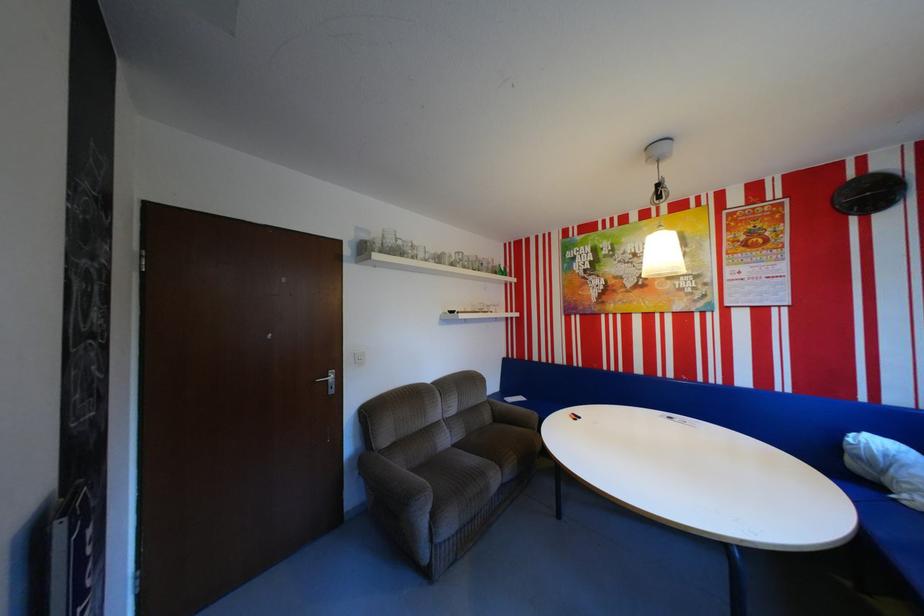
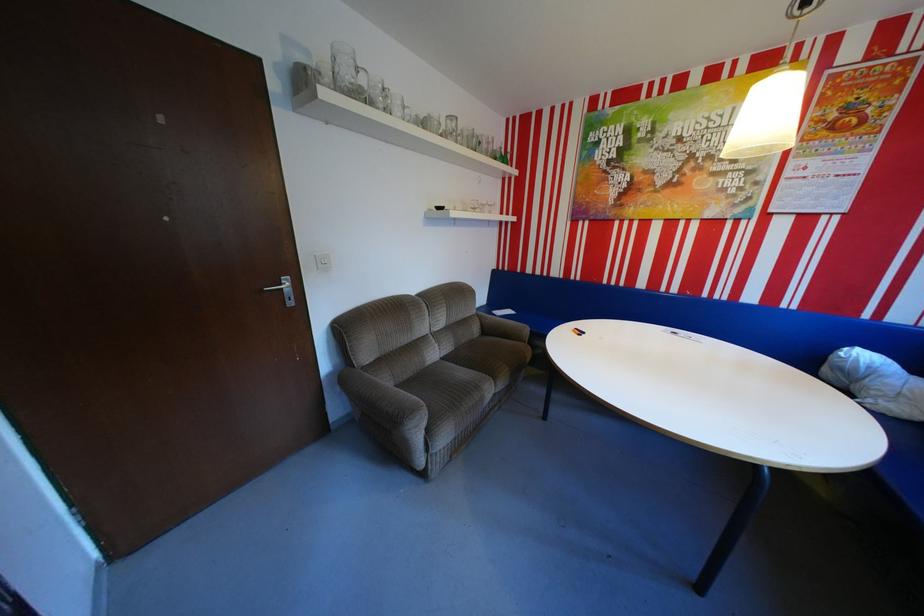
In the second image, find the point that corresponds to point 886,442 in the first image.

(874, 355)